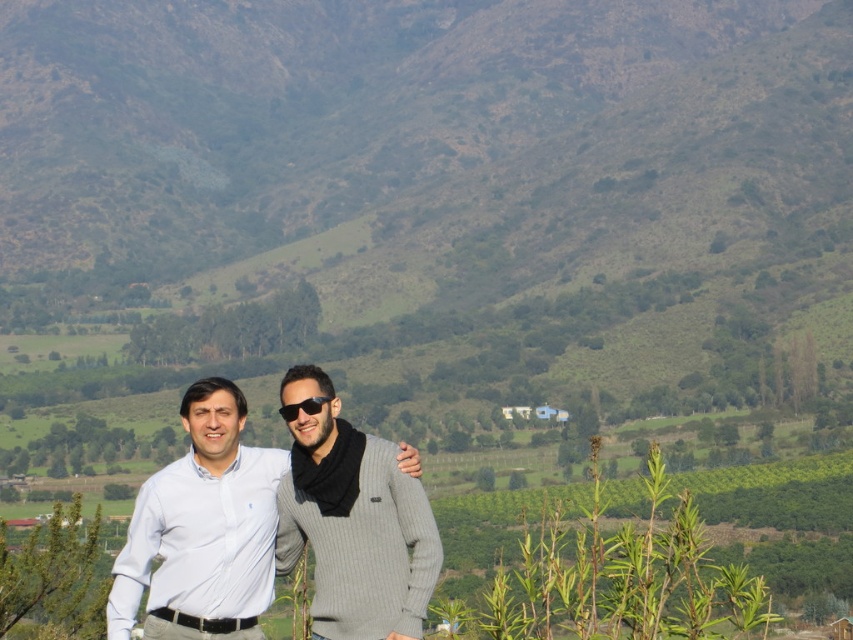
Question: Is white cotton shirt at center thinner than gray ribbed sweater at center?

Choices:
 (A) yes
 (B) no

Answer: (B)

Question: Among these points, which one is nearest to the camera?

Choices:
 (A) (142, 509)
 (B) (366, 568)

Answer: (B)

Question: Can you confirm if white cotton shirt at center is positioned to the left of gray ribbed sweater at center?

Choices:
 (A) yes
 (B) no

Answer: (A)

Question: Does white cotton shirt at center appear on the left side of gray ribbed sweater at center?

Choices:
 (A) yes
 (B) no

Answer: (A)

Question: Which object appears closest to the camera in this image?

Choices:
 (A) gray ribbed sweater at center
 (B) white cotton shirt at center

Answer: (B)